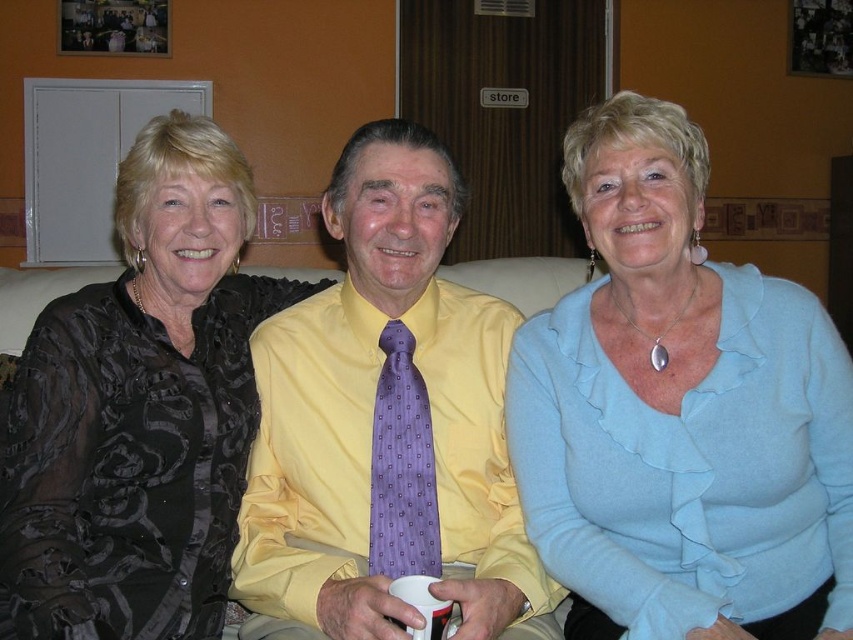
Does point (250, 545) come in front of point (170, 320)?

Yes, point (250, 545) is in front of point (170, 320).

From the picture: Between yellow satin shirt at center and black satin blouse at left, which one has more height?

Standing taller between the two is black satin blouse at left.

Is point (350, 344) less distant than point (135, 545)?

That is False.

At what (x,y) coordinates should I click in order to perform the action: click on yellow satin shirt at center. Please return your answer as a coordinate pair (x, y). Looking at the image, I should click on (387, 420).

Between light blue fabric at center and purple silk tie at center, which one appears on the left side from the viewer's perspective?

Positioned to the left is purple silk tie at center.

Who is more forward, (828, 504) or (376, 544)?

Positioned in front is point (828, 504).

Between point (573, 317) and point (430, 561), which one is positioned behind?

Point (573, 317)

Where is `light blue fabric at center`? Image resolution: width=853 pixels, height=640 pixels. light blue fabric at center is located at coordinates (680, 412).

You are a GUI agent. You are given a task and a screenshot of the screen. Output one action in this format:
    pyautogui.click(x=<x>, y=<y>)
    Task: Click on the yellow satin shirt at center
    This screenshot has height=640, width=853.
    Given the screenshot: What is the action you would take?
    pyautogui.click(x=387, y=420)

Is yellow satin shirt at center bigger than purple silk tie at center?

Indeed, yellow satin shirt at center has a larger size compared to purple silk tie at center.

Does point (241, 598) lie in front of point (415, 396)?

Yes.

Locate an element on the screen. yellow satin shirt at center is located at coordinates (387, 420).